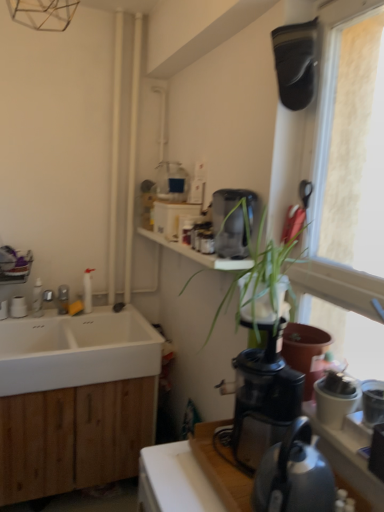
In order to click on vacant space to the right of brushed metal faucet at left in this screenshot , I will do `click(95, 318)`.